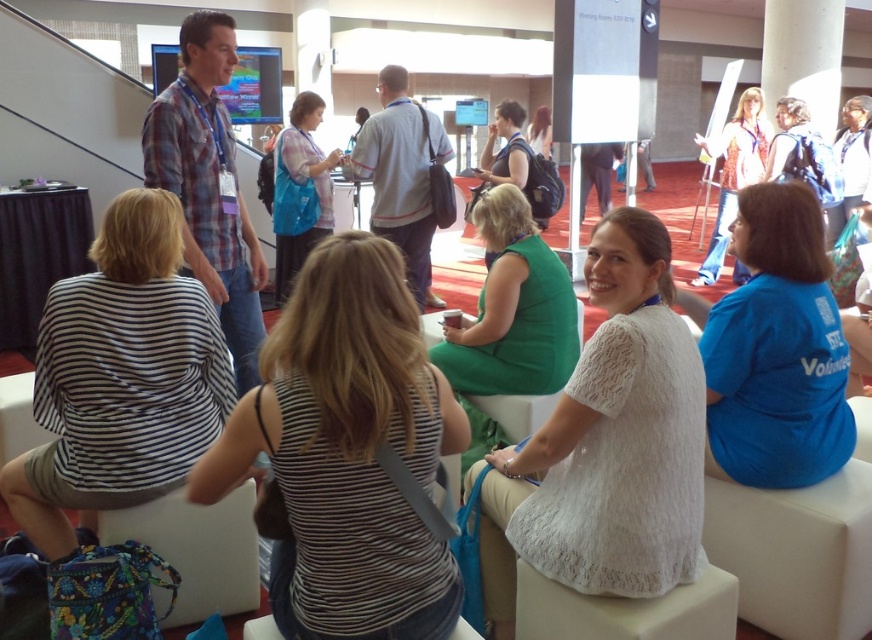
You are at the event and need to locate the volunteer wearing a blue shirt with the word Volunteer printed on it. You see the matte blue backpack at center and the white shirt at upper right. Which direction should you move to find the volunteer?

The volunteer wearing the blue shirt with Volunteer printed on it is located to the right of the matte blue backpack at center, so you should move towards the white shirt at upper right direction to find them.